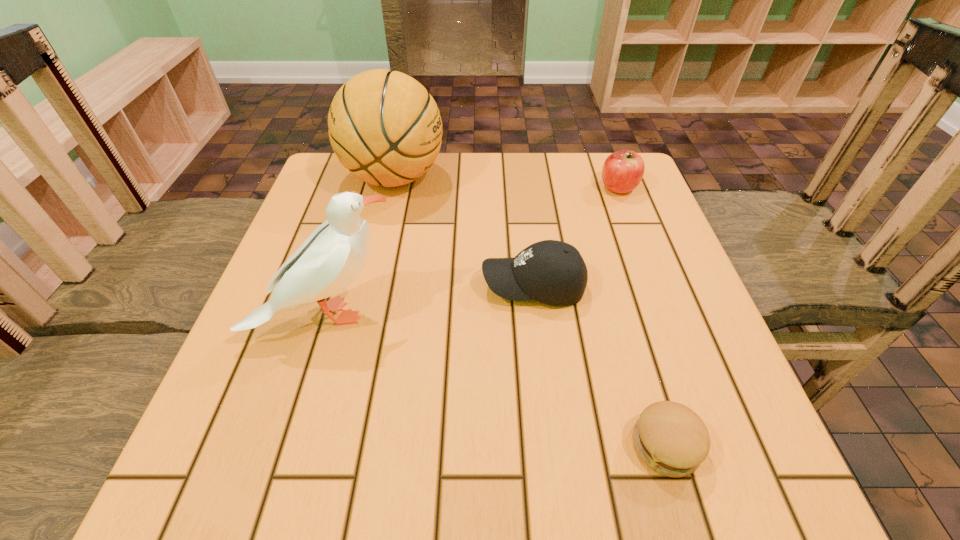
At what (x,y) coordinates should I click in order to perform the action: click on free location that satisfies the following two spatial constraints: 1. on the back side of the hamburger; 2. on the surface of the basketball near the brand logo. Please return your answer as a coordinate pair (x, y). This screenshot has height=540, width=960. Looking at the image, I should click on (586, 178).

Locate an element on the screen. The height and width of the screenshot is (540, 960). vacant position in the image that satisfies the following two spatial constraints: 1. on the front side of the apple; 2. on the front-facing side of the third object from right to left is located at coordinates (657, 286).